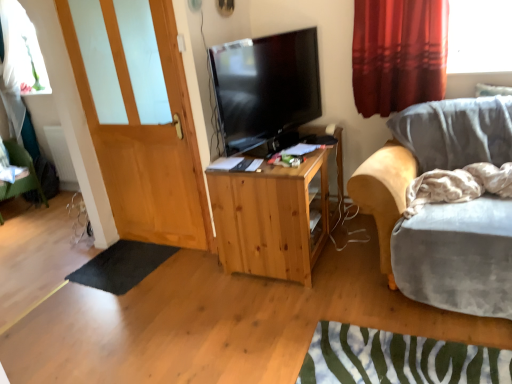
Question: Should I look upward or downward to see white matte radiator at lower left?

Choices:
 (A) down
 (B) up

Answer: (B)

Question: From the image's perspective, would you say wooden door at left is positioned over black glossy tv at center?

Choices:
 (A) yes
 (B) no

Answer: (B)

Question: Is wooden door at left not within black glossy tv at center?

Choices:
 (A) no
 (B) yes

Answer: (B)

Question: Considering the relative positions of wooden door at left and black glossy tv at center in the image provided, is wooden door at left to the left of black glossy tv at center from the viewer's perspective?

Choices:
 (A) yes
 (B) no

Answer: (A)

Question: From a real-world perspective, is wooden door at left on black glossy tv at center?

Choices:
 (A) no
 (B) yes

Answer: (A)

Question: Can you confirm if wooden door at left is taller than black glossy tv at center?

Choices:
 (A) no
 (B) yes

Answer: (B)

Question: Is wooden door at left wider than black glossy tv at center?

Choices:
 (A) yes
 (B) no

Answer: (B)

Question: Is white fabric pillow at upper right in contact with black glossy tv at center?

Choices:
 (A) yes
 (B) no

Answer: (B)

Question: Considering the relative sizes of white fabric pillow at upper right and black glossy tv at center in the image provided, is white fabric pillow at upper right taller than black glossy tv at center?

Choices:
 (A) no
 (B) yes

Answer: (A)

Question: Is white fabric pillow at upper right positioned with its back to black glossy tv at center?

Choices:
 (A) no
 (B) yes

Answer: (A)

Question: Is black glossy tv at center located within white fabric pillow at upper right?

Choices:
 (A) no
 (B) yes

Answer: (A)

Question: From the image's perspective, is white fabric pillow at upper right above black glossy tv at center?

Choices:
 (A) yes
 (B) no

Answer: (B)

Question: Is white fabric pillow at upper right wider than black glossy tv at center?

Choices:
 (A) no
 (B) yes

Answer: (A)

Question: Can you confirm if black rubber mat at lower left is shorter than velvet grey chair at right?

Choices:
 (A) no
 (B) yes

Answer: (B)